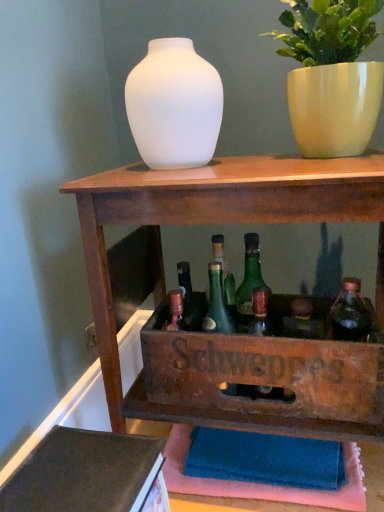
Where is `free space in front of frosted glass vase at center`? The image size is (384, 512). free space in front of frosted glass vase at center is located at coordinates (190, 177).